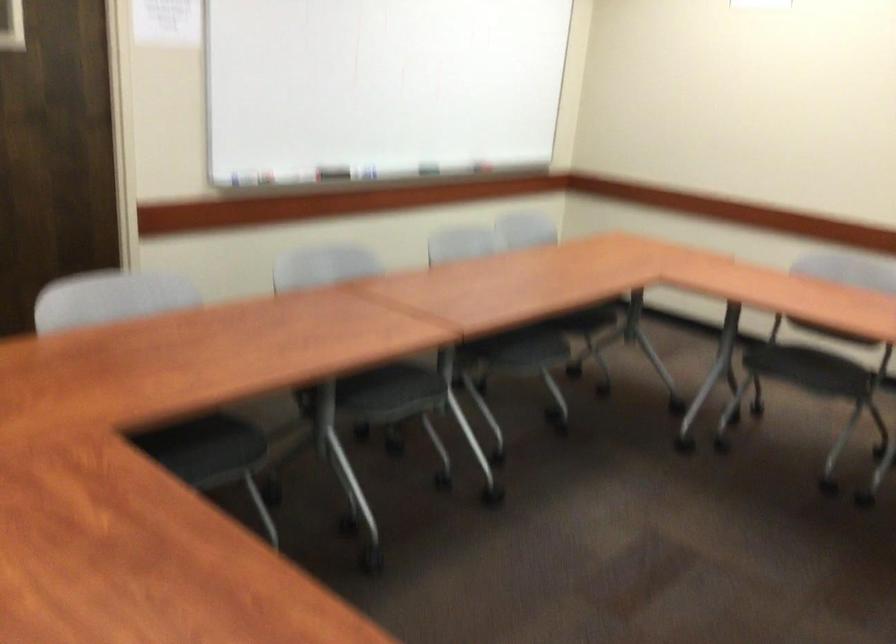
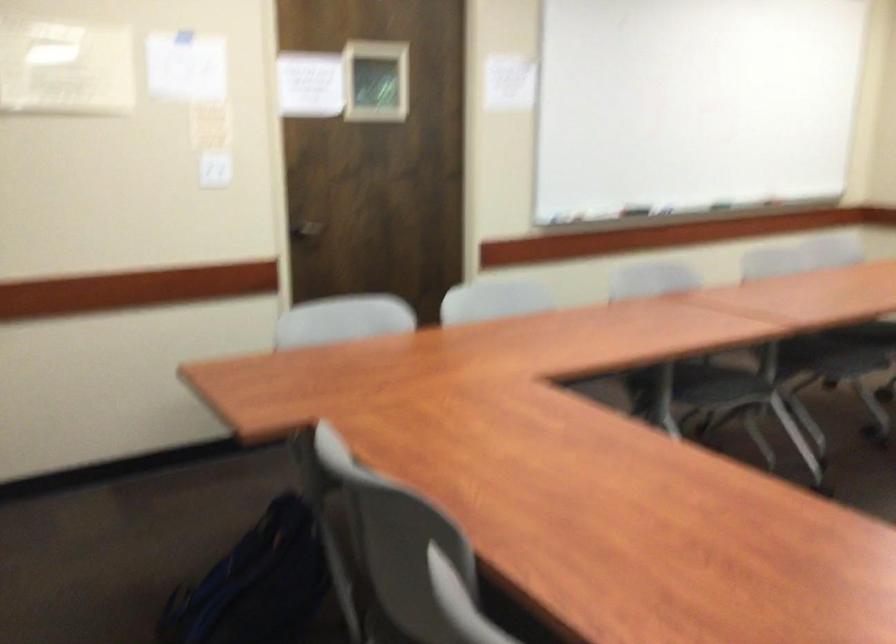
Question: Based on the continuous images, in which direction is the camera rotating? Reply with the corresponding letter.

Choices:
 (A) Left
 (B) Right
 (C) Up
 (D) Down

Answer: (A)